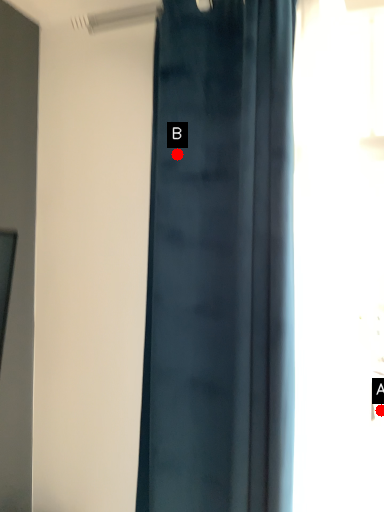
Question: Two points are circled on the image, labeled by A and B beside each circle. Which point appears farthest from the camera in this image?

Choices:
 (A) A is further
 (B) B is further

Answer: (A)